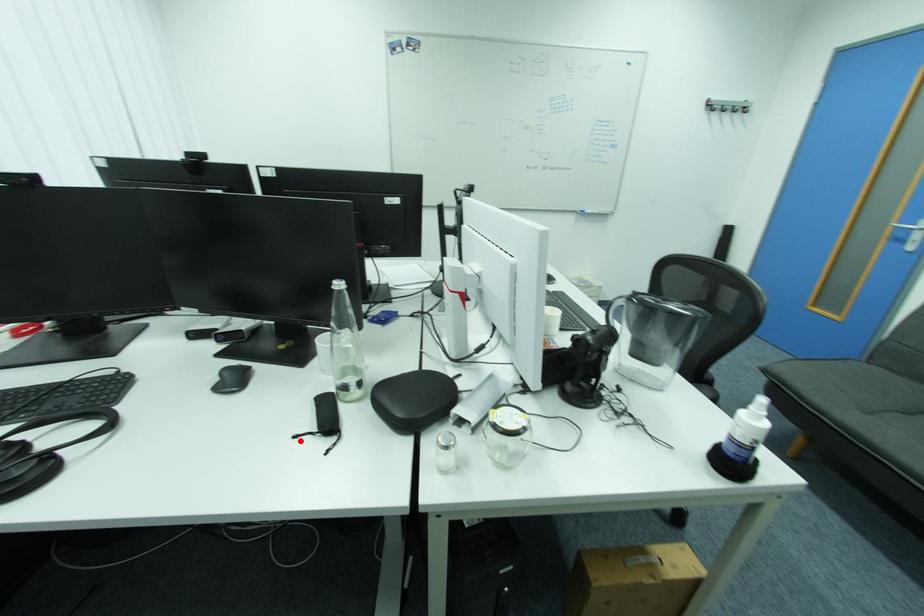
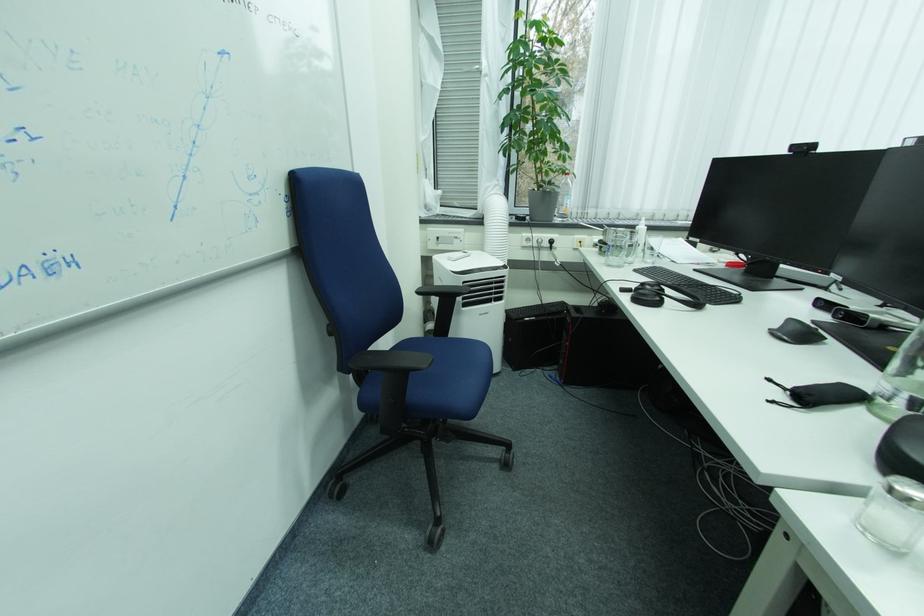
The point at the highlighted location is marked in the first image. Where is the corresponding point in the second image?

(773, 383)